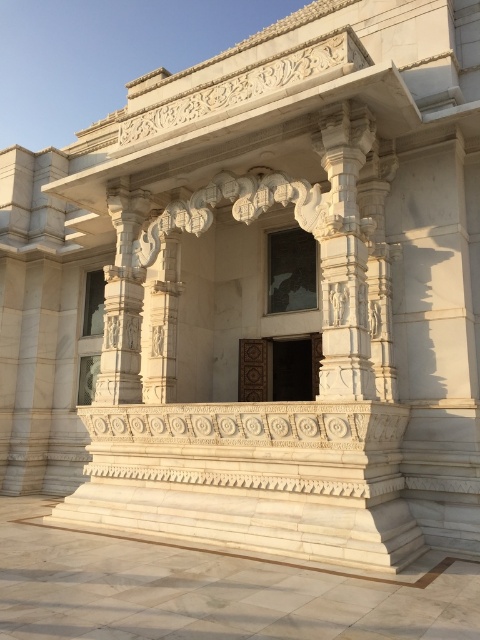
You are an architect examining the building structure. You notice a specific point at coordinates point (344, 256). Based on the scene description, can you determine which architectural element this point is located on?

The point (344, 256) is located on the white stone column at center.